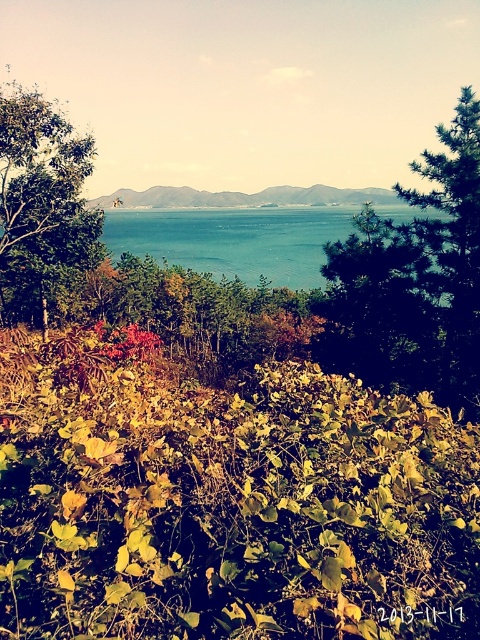
Does green textured tree at upper right have a lesser width compared to green leafy tree at upper left?

Yes.

Who is more distant from viewer, (448,275) or (0,202)?

The point (0,202) is behind.

Is point (468, 209) closer to viewer compared to point (72, 237)?

Yes, point (468, 209) is closer to viewer.

At what (x,y) coordinates should I click in order to perform the action: click on green textured tree at upper right. Please return your answer as a coordinate pair (x, y). Looking at the image, I should click on (414, 280).

Is green textured tree at upper right above blue water at center?

No, green textured tree at upper right is not above blue water at center.

Is point (428, 157) in front of point (420, 250)?

That is True.

Is point (452, 193) in front of point (196, 244)?

Yes, it is in front of point (196, 244).

Locate an element on the screen. green textured tree at upper right is located at coordinates (414, 280).

Between green leafy tree at upper left and green leafy hillside at center, which one appears on the right side from the viewer's perspective?

green leafy hillside at center is more to the right.

Does point (49, 195) come behind point (299, 186)?

No, (49, 195) is closer to viewer.

Image resolution: width=480 pixels, height=640 pixels. In order to click on green leafy tree at upper left in this screenshot , I will do `click(41, 193)`.